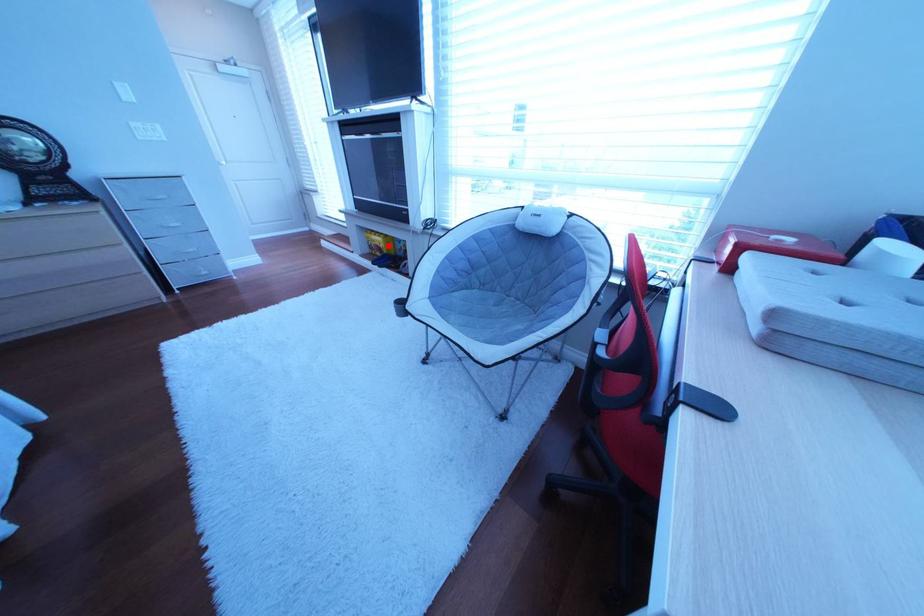
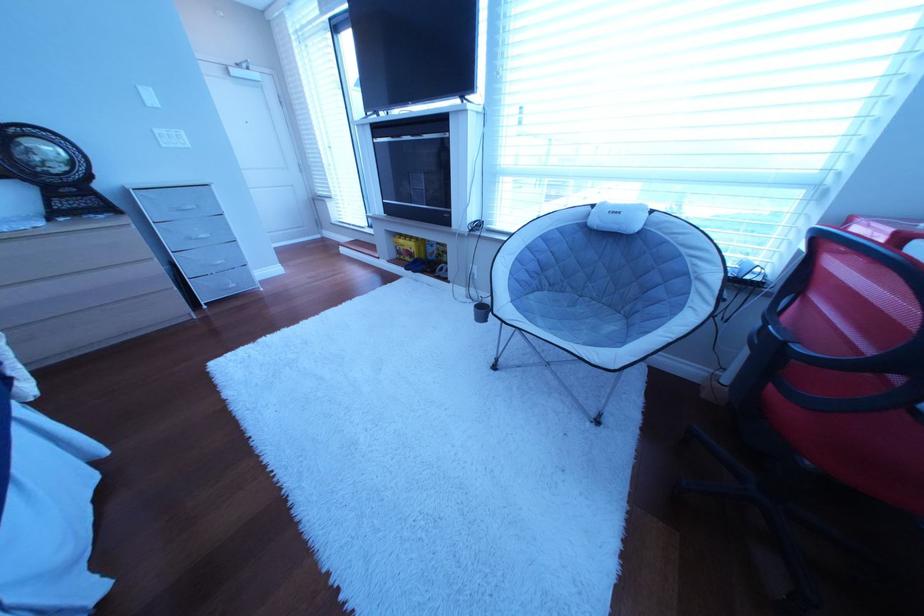
The point at the highlighted location is marked in the first image. Where is the corresponding point in the second image?

(418, 251)